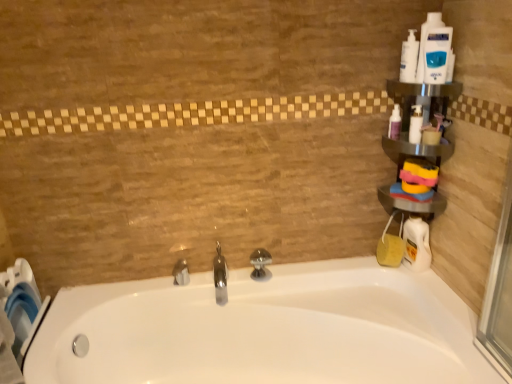
Question: Considering the relative positions of metallic silver shelf at upper right and polished chrome faucet at center, which is counted as the 2th tap, starting from the left, in the image provided, is metallic silver shelf at upper right to the left of polished chrome faucet at center, which is counted as the 2th tap, starting from the left, from the viewer's perspective?

Choices:
 (A) no
 (B) yes

Answer: (A)

Question: Is metallic silver shelf at upper right bigger than polished chrome faucet at center, which is counted as the 2th tap, starting from the left?

Choices:
 (A) no
 (B) yes

Answer: (B)

Question: Does metallic silver shelf at upper right have a greater width compared to polished chrome faucet at center, which is counted as the 2th tap, starting from the left?

Choices:
 (A) yes
 (B) no

Answer: (B)

Question: Is metallic silver shelf at upper right positioned far away from polished chrome faucet at center, which is counted as the 2th tap, starting from the left?

Choices:
 (A) no
 (B) yes

Answer: (A)

Question: From the image's perspective, is metallic silver shelf at upper right over polished chrome faucet at center, which is counted as the 2th tap, starting from the left?

Choices:
 (A) no
 (B) yes

Answer: (B)

Question: Is metallic silver shelf at upper right directly adjacent to polished chrome faucet at center, which is counted as the 2th tap, starting from the left?

Choices:
 (A) yes
 (B) no

Answer: (B)

Question: Is white glossy bottle at right, the 5th cleaning product in the top-to-bottom sequence, further to the viewer compared to white glossy bathtub at center?

Choices:
 (A) no
 (B) yes

Answer: (B)

Question: Is white glossy bottle at right, the 5th cleaning product in the top-to-bottom sequence, thinner than white glossy bathtub at center?

Choices:
 (A) no
 (B) yes

Answer: (B)

Question: From the image's perspective, does white glossy bottle at right, positioned as the first cleaning product in bottom-to-top order, appear higher than white glossy bathtub at center?

Choices:
 (A) yes
 (B) no

Answer: (A)

Question: Can you confirm if white glossy bottle at right, positioned as the first cleaning product in bottom-to-top order, is taller than white glossy bathtub at center?

Choices:
 (A) yes
 (B) no

Answer: (B)

Question: Could you tell me if white glossy bottle at right, the 5th cleaning product in the top-to-bottom sequence, is facing white glossy bathtub at center?

Choices:
 (A) no
 (B) yes

Answer: (A)

Question: Can you confirm if white glossy bottle at right, positioned as the first cleaning product in bottom-to-top order, is wider than white glossy bathtub at center?

Choices:
 (A) no
 (B) yes

Answer: (A)

Question: From the image's perspective, is silver metallic tap at center, marked as the 1th tap in a left-to-right arrangement, above polished chrome tap at center, arranged as the third tap when viewed from the left?

Choices:
 (A) no
 (B) yes

Answer: (A)